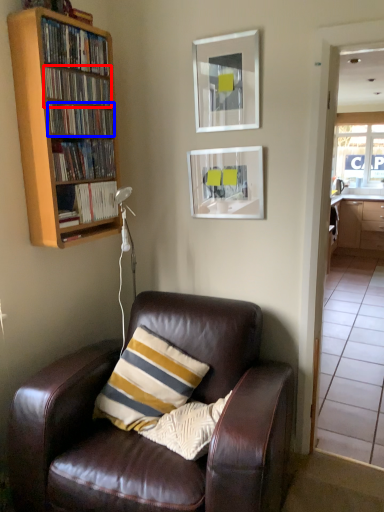
Question: Which of the following is the farthest to the observer, book (highlighted by a red box) or book (highlighted by a blue box)?

Choices:
 (A) book
 (B) book

Answer: (B)